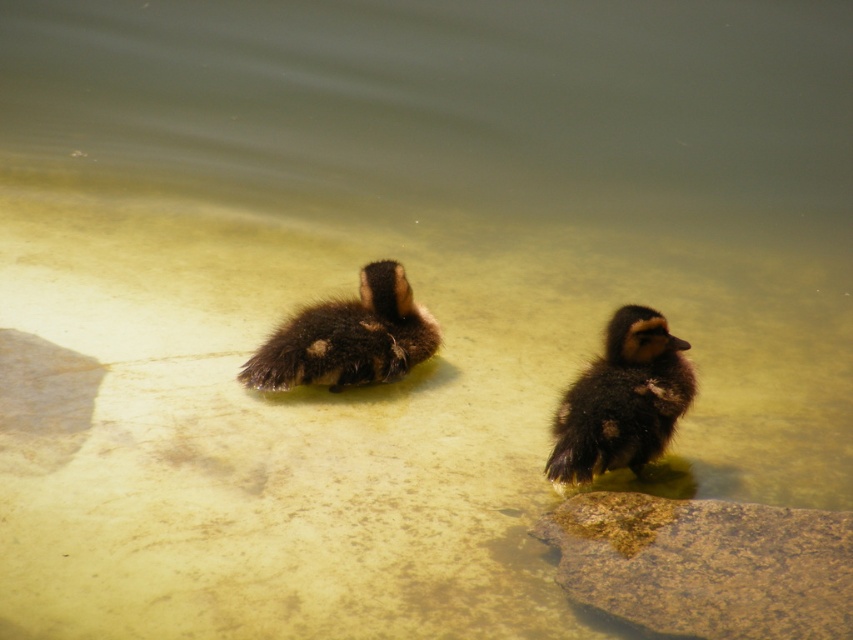
Who is more distant from viewer, (665, 534) or (663, 326)?

Point (663, 326)

Is brown textured rock at lower right further to camera compared to dark brown fluffy duckling at center?

That is False.

Where is `brown textured rock at lower right`? The image size is (853, 640). brown textured rock at lower right is located at coordinates (x=705, y=564).

Between point (598, 406) and point (430, 332), which one is positioned in front?

Positioned in front is point (598, 406).

Is dark brown fluffy duckling at center to the left of brown fuzzy duckling at center from the viewer's perspective?

Incorrect, dark brown fluffy duckling at center is not on the left side of brown fuzzy duckling at center.

Is point (583, 474) positioned in front of point (248, 368)?

Yes, point (583, 474) is closer to viewer.

Find the location of a particular element. dark brown fluffy duckling at center is located at coordinates (622, 400).

Is brown textured rock at lower right bigger than brown fuzzy duckling at center?

Yes.

Who is positioned more to the left, brown textured rock at lower right or brown fuzzy duckling at center?

From the viewer's perspective, brown fuzzy duckling at center appears more on the left side.

Is point (688, 609) less distant than point (352, 376)?

Yes, point (688, 609) is in front of point (352, 376).

Locate an element on the screen. Image resolution: width=853 pixels, height=640 pixels. brown textured rock at lower right is located at coordinates (705, 564).